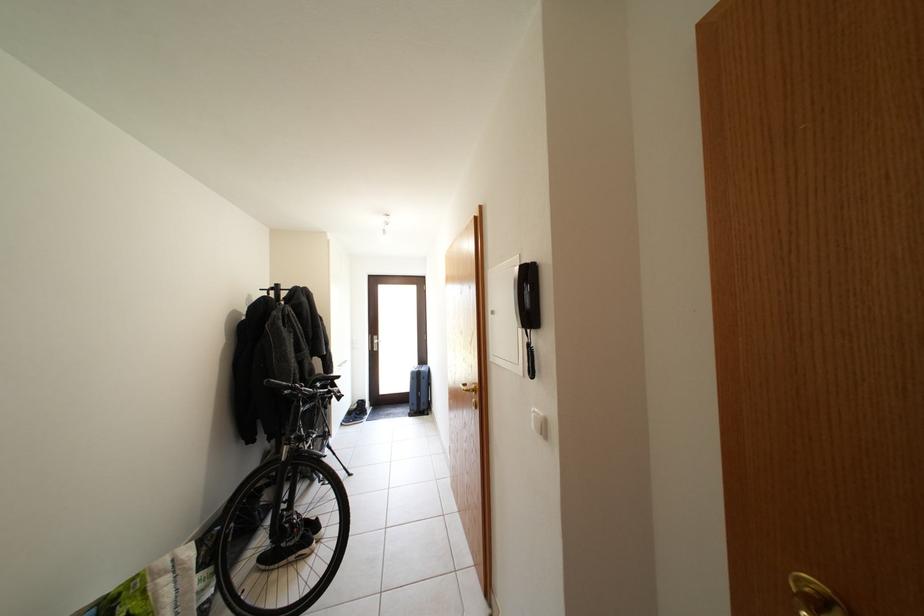
This screenshot has height=616, width=924. Identify the location of silver door handle. (372, 339).